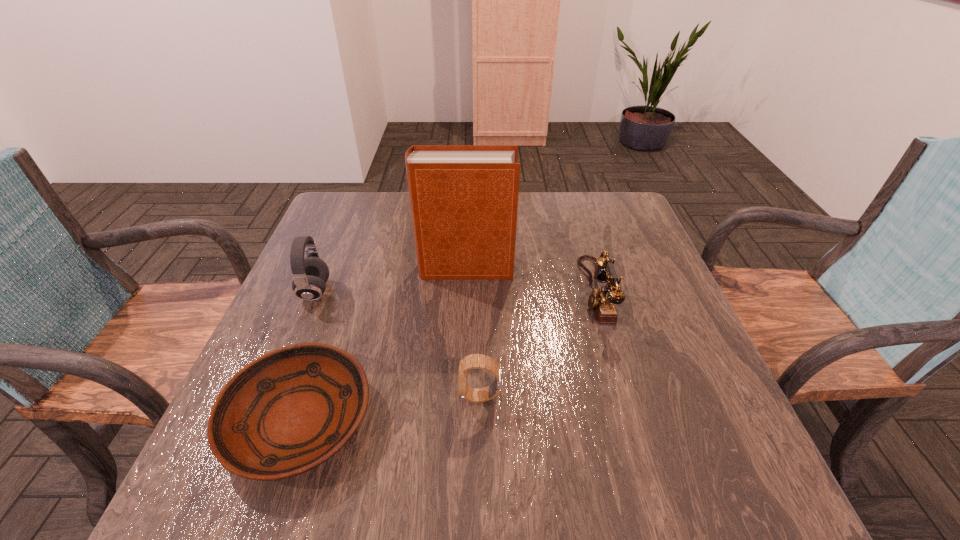
Where is `vacant space at the left edge of the desktop`? Image resolution: width=960 pixels, height=540 pixels. vacant space at the left edge of the desktop is located at coordinates (322, 325).

Where is `free space at the right edge of the desktop`? free space at the right edge of the desktop is located at coordinates (635, 373).

Image resolution: width=960 pixels, height=540 pixels. In order to click on vacant space at the far right corner of the desktop in this screenshot , I will do `click(608, 197)`.

I want to click on free spot between the rightmost object and the tallest object, so click(530, 280).

You are a GUI agent. You are given a task and a screenshot of the screen. Output one action in this format:
    pyautogui.click(x=<x>, y=<y>)
    Task: Click on the free space between the fourth shortest object and the hardback book
    This screenshot has height=540, width=960.
    Given the screenshot: What is the action you would take?
    pyautogui.click(x=390, y=280)

Where is `unoccupied position between the fourth shortest object and the telephone`? The height and width of the screenshot is (540, 960). unoccupied position between the fourth shortest object and the telephone is located at coordinates (455, 291).

This screenshot has height=540, width=960. Find the location of `vacant area that lies between the tallest object and the watch`. vacant area that lies between the tallest object and the watch is located at coordinates (472, 333).

The height and width of the screenshot is (540, 960). Find the location of `vacant space that is in between the fourth shortest object and the rightmost object`. vacant space that is in between the fourth shortest object and the rightmost object is located at coordinates (455, 291).

Where is `vacant area between the plate and the rightmost object`? Image resolution: width=960 pixels, height=540 pixels. vacant area between the plate and the rightmost object is located at coordinates (447, 356).

The width and height of the screenshot is (960, 540). I want to click on free spot between the plate and the watch, so click(x=390, y=408).